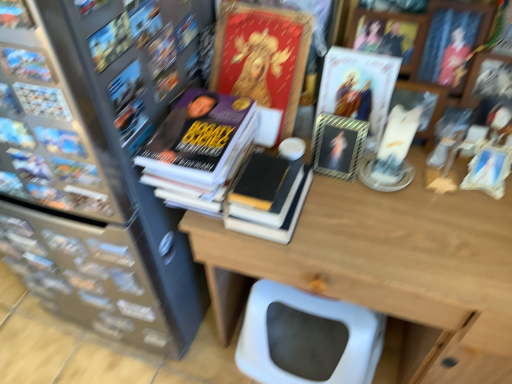
Question: Is point (39, 61) closer or farther from the camera than point (347, 180)?

Choices:
 (A) closer
 (B) farther

Answer: (A)

Question: Is matte black book at upper left, positioned as the 1th book in front-to-back order, inside or outside of metallic silver frame at upper center, positioned as the 2th book cover in left-to-right order?

Choices:
 (A) inside
 (B) outside

Answer: (B)

Question: Based on their relative distances, which object is farther from the matte black book at left, the second book positioned from the back?

Choices:
 (A) hardcover book at center, arranged as the third book when viewed from the front
 (B) matte black book at upper left, the first book positioned from the left
 (C) metallic gold frame at upper center, the 1th book cover when ordered from right to left
 (D) matte gold book at center, marked as the third book cover in a right-to-left arrangement
 (E) metallic silver frame at upper center, positioned as the 2th book cover in left-to-right order

Answer: (C)

Question: Estimate the real-world distances between objects in this image. Which object is closer to the matte black book at upper left, positioned as the 1th book in front-to-back order?

Choices:
 (A) hardcover book at center, the first book when ordered from right to left
 (B) matte black bookcase at left
 (C) metallic silver frame at upper center, positioned as the 2th book cover in left-to-right order
 (D) metallic gold frame at upper center, which is the 3th book cover from left to right
 (E) wooden table at center

Answer: (A)